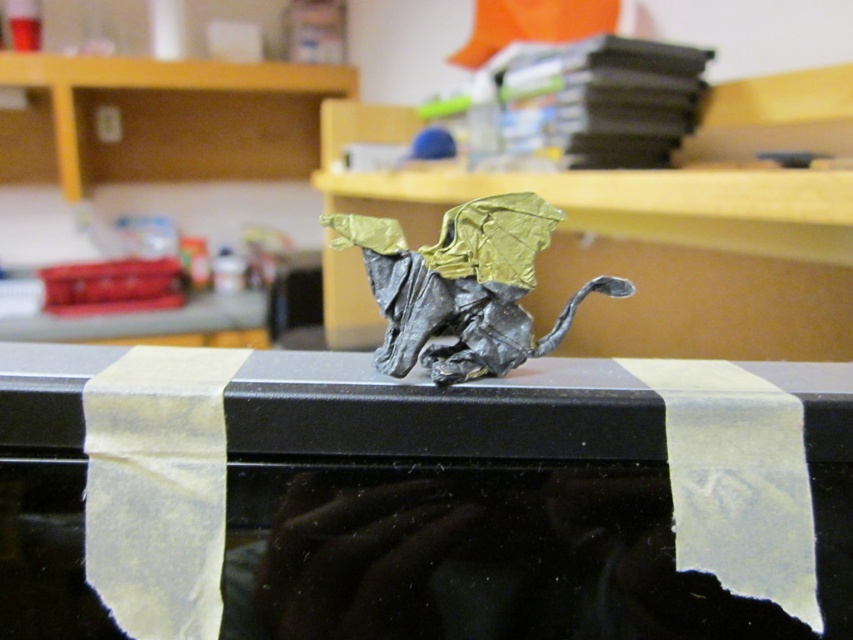
Who is positioned more to the right, metallic gold origami at center or gold metallic dragon at center?

Positioned to the right is gold metallic dragon at center.

Is point (430, 541) positioned before point (492, 220)?

Yes, point (430, 541) is closer to viewer.

Where is `metallic gold origami at center`? This screenshot has height=640, width=853. metallic gold origami at center is located at coordinates (459, 508).